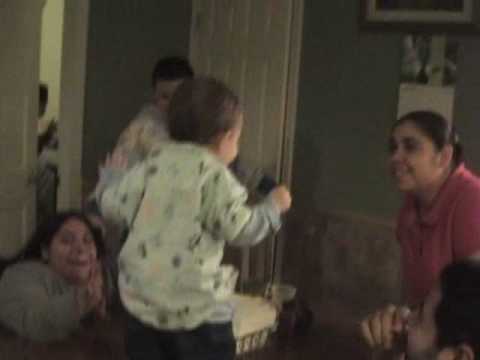
The width and height of the screenshot is (480, 360). I want to click on white door, so click(254, 61).